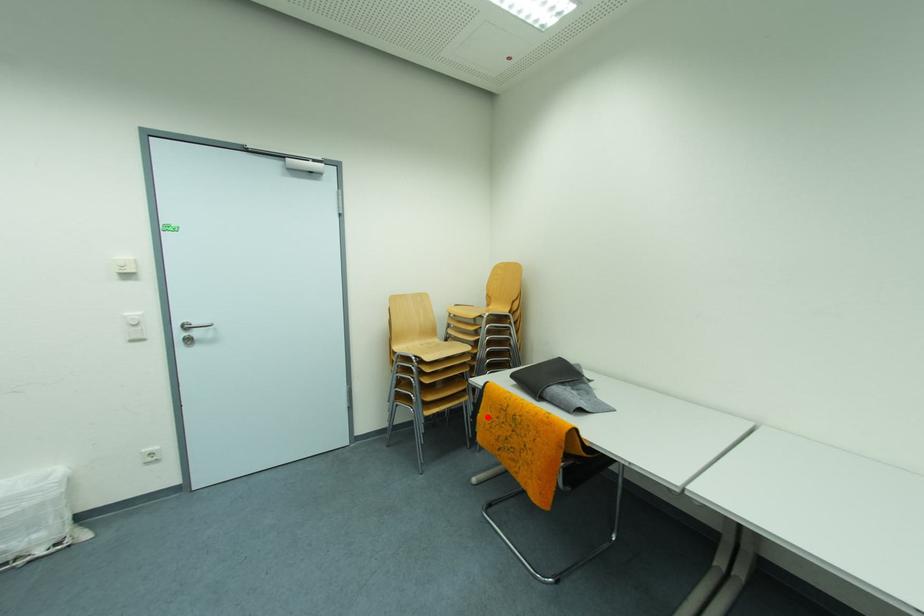
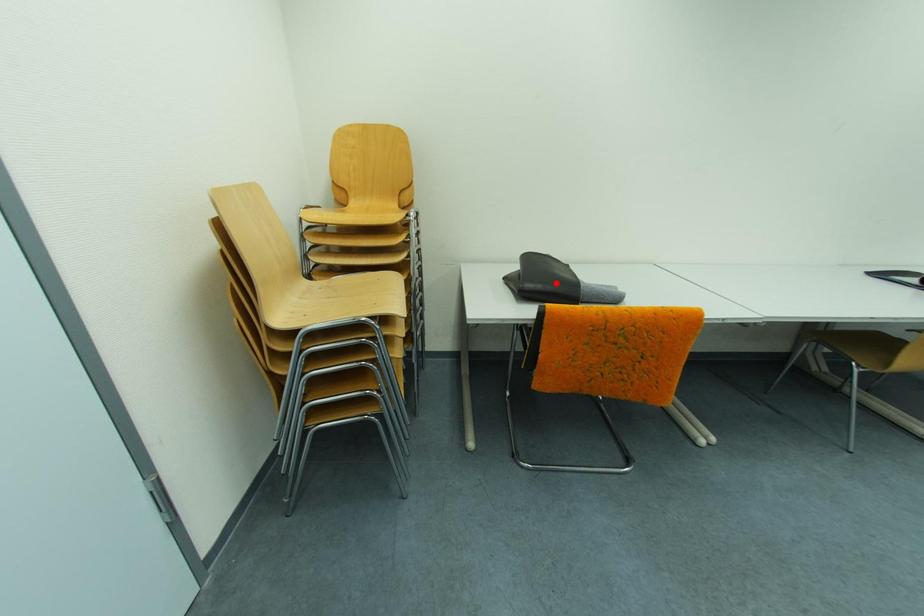
I am providing you with two images of the same scene from different viewpoints. A red point is marked on the first image and another point is marked on the second image. Is the red point in image1 aligned with the point shown in image2?

No